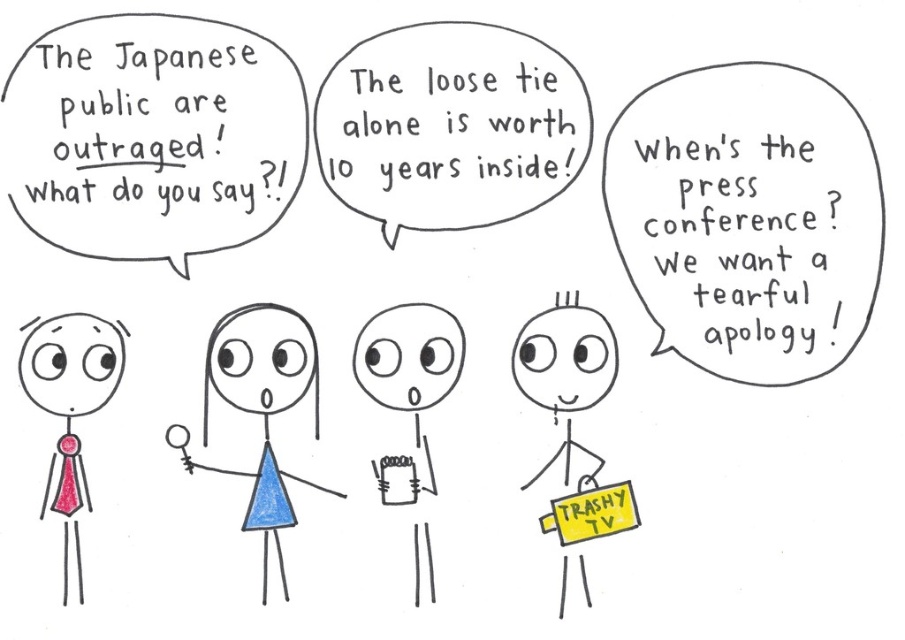
In the cartoon scene, there are two objects mentioned in the dialogue between the figures. The blue paper doll at center and the matte pink tie at left are part of the conversation. According to their positions, which object is positioned to the right of the other?

The blue paper doll at center is to the right of the matte pink tie at left, so the blue paper doll at center is positioned to the right of the matte pink tie at left.

You are observing the scene and want to know which object is closer to you. Which is closer between the blue paper doll at center and the matte pink tie at left?

The blue paper doll at center is closer to you because it is further to the viewer than the matte pink tie at left.